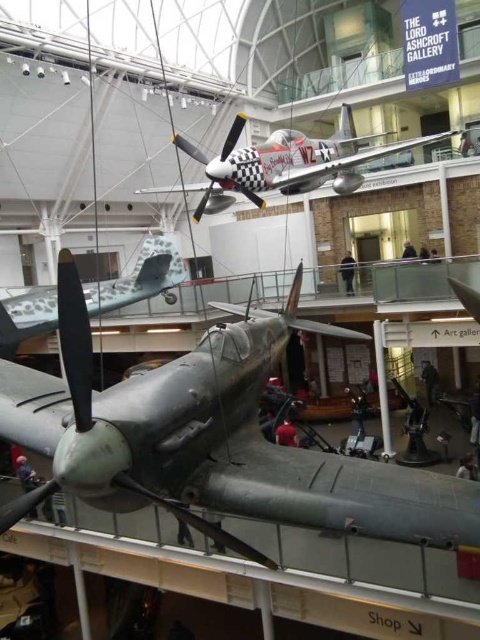
Question: Which of the following is the closest to the observer?

Choices:
 (A) green matte airplane at center
 (B) polished silver airplane at upper center

Answer: (A)

Question: Which of the following is the farthest from the observer?

Choices:
 (A) polished silver airplane at upper center
 (B) green matte airplane at center
 (C) camouflage paint airplane at center

Answer: (C)

Question: Is green matte airplane at center smaller than polished silver airplane at upper center?

Choices:
 (A) yes
 (B) no

Answer: (A)

Question: Which point is farther to the camera?

Choices:
 (A) (333, 492)
 (B) (51, 308)

Answer: (B)

Question: Does polished silver airplane at upper center have a lesser width compared to camouflage paint airplane at center?

Choices:
 (A) yes
 (B) no

Answer: (B)

Question: In this image, where is green matte airplane at center located relative to camouflage paint airplane at center?

Choices:
 (A) below
 (B) above

Answer: (A)